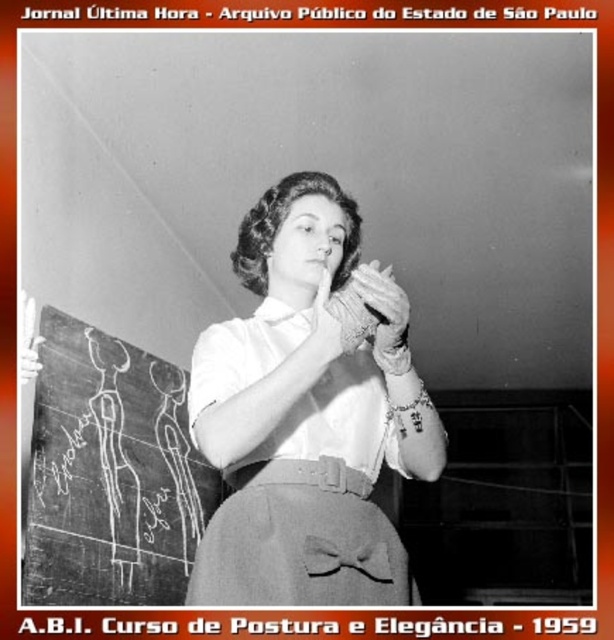
Does chalkboard at left lie in front of black chalkboard at upper left?

That is True.

Is point (134, 490) positioned behind point (273, 632)?

Yes, it is.

The width and height of the screenshot is (614, 640). What do you see at coordinates (111, 474) in the screenshot?
I see `chalkboard at left` at bounding box center [111, 474].

Find the location of `chalkboard at left`. chalkboard at left is located at coordinates (111, 474).

Which of these two, matte gray apron at center or black chalkboard at upper left, stands shorter?

black chalkboard at upper left

Who is higher up, matte gray apron at center or black chalkboard at upper left?

matte gray apron at center

What are the coordinates of `matte gray apron at center` in the screenshot? It's located at (300, 541).

Can you confirm if white satin blouse at center is thinner than white chalkboard at upper left?

Yes.

Who is positioned more to the left, white satin blouse at center or white chalkboard at upper left?

From the viewer's perspective, white chalkboard at upper left appears more on the left side.

Which is behind, point (336, 506) or point (494, 17)?

Point (494, 17)

Locate an element on the screen. The height and width of the screenshot is (640, 614). white satin blouse at center is located at coordinates click(x=308, y=413).